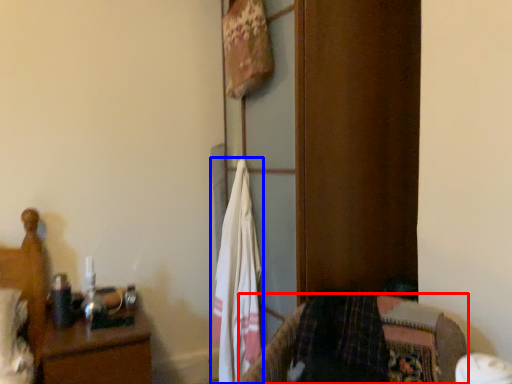
Question: Which of the following is the farthest to the observer, furniture (highlighted by a red box) or laundry (highlighted by a blue box)?

Choices:
 (A) furniture
 (B) laundry

Answer: (B)